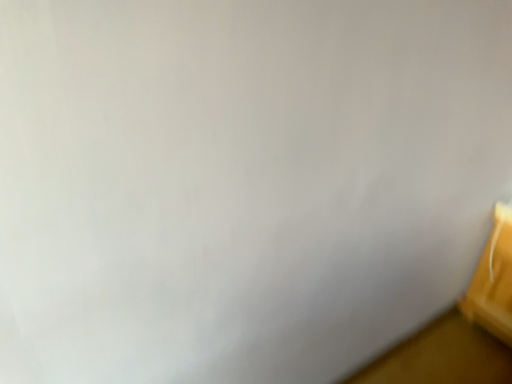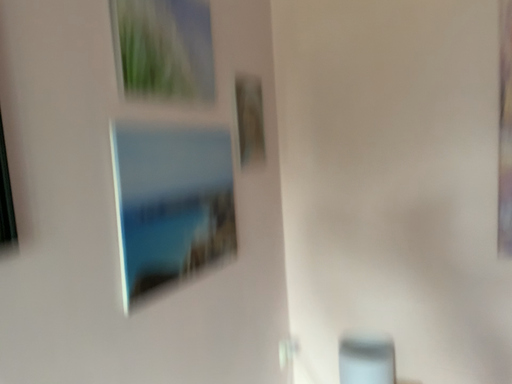
Question: Which way did the camera rotate in the video?

Choices:
 (A) rotated upward
 (B) rotated downward

Answer: (A)